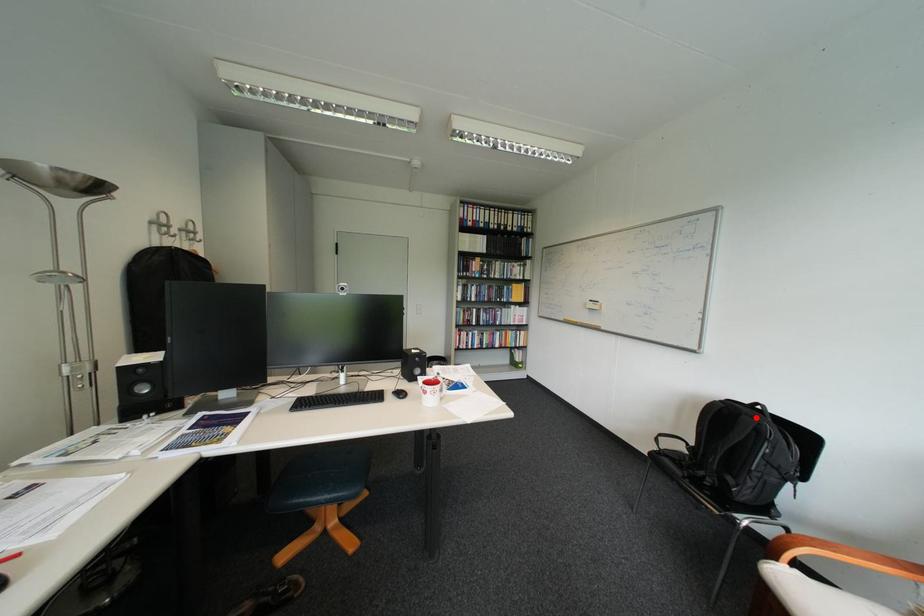
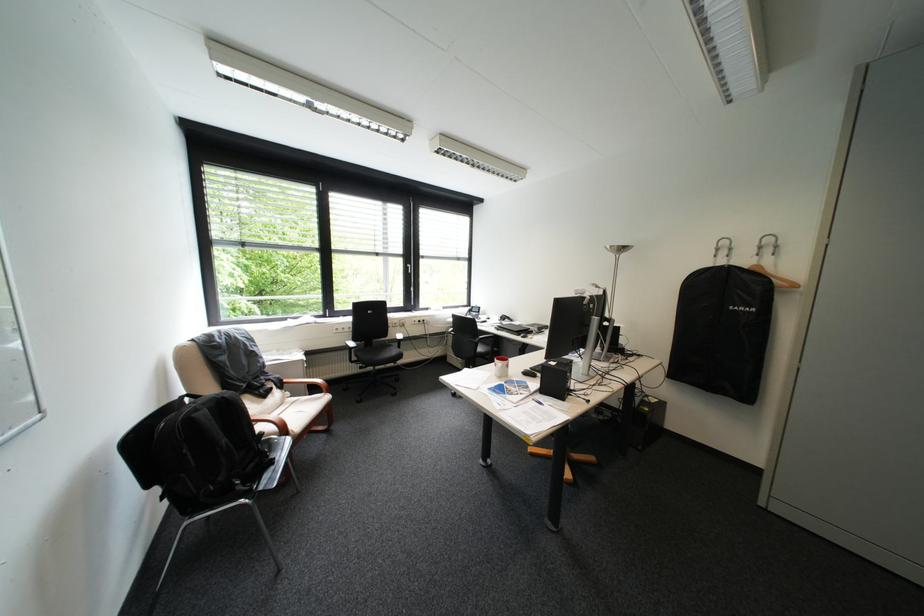
Question: I am providing you with two images of the same scene from different viewpoints. Image1 has a red point marked. In image2, the corresponding 3D location appears at what relative position? Reply with the corresponding letter.

Choices:
 (A) Closer
 (B) Farther

Answer: (A)